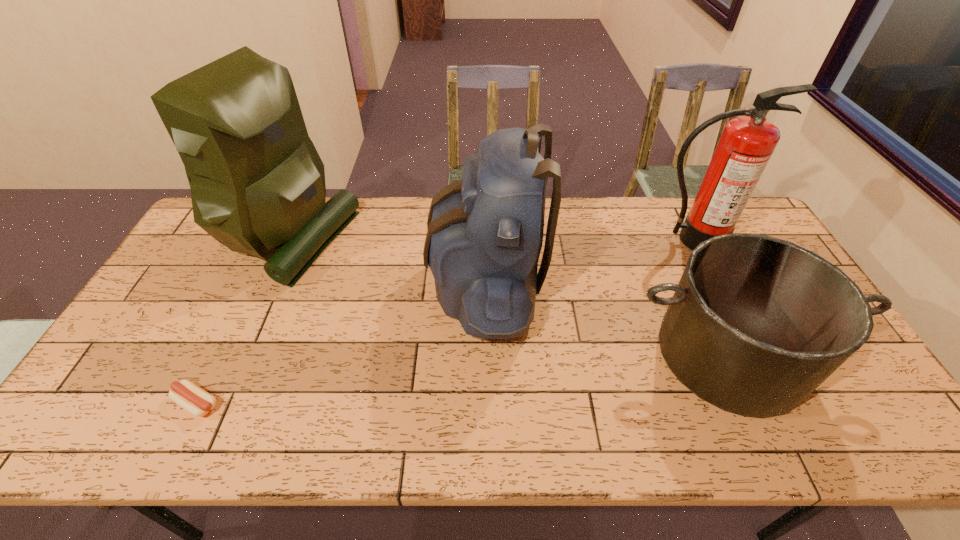
Where is `vacant space located on the left of the pan`? vacant space located on the left of the pan is located at coordinates (481, 355).

This screenshot has width=960, height=540. Identify the location of vacant area located 0.240m on the back of the shortest object. (242, 311).

Locate an element on the screen. fire extinguisher located in the far edge section of the desktop is located at coordinates (746, 145).

Identify the location of pan that is at the near edge. (756, 324).

Image resolution: width=960 pixels, height=540 pixels. I want to click on sausage present at the near edge, so click(x=186, y=394).

Where is `object present at the left edge`? The height and width of the screenshot is (540, 960). object present at the left edge is located at coordinates pos(257,182).

Find the location of `fire extinguisher located at the right edge`. fire extinguisher located at the right edge is located at coordinates (746, 145).

The image size is (960, 540). I want to click on pan that is at the right edge, so click(756, 324).

What are the coordinates of `object that is at the far left corner` in the screenshot? It's located at (257, 182).

Image resolution: width=960 pixels, height=540 pixels. What are the coordinates of `object located in the far right corner section of the desktop` in the screenshot? It's located at (746, 145).